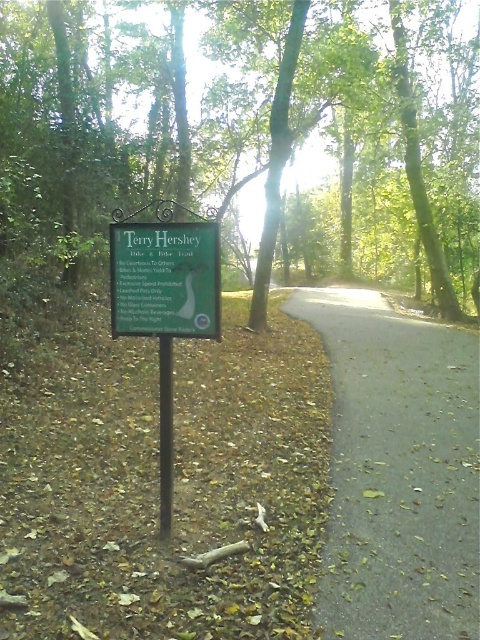
You are standing at the signpost on the left side of the path and want to walk directly towards the green leafy tree at center. In which direction should you walk relative to the path?

You should walk towards the center of the path since the green leafy tree at center is located at point (238, 125), which is directly ahead along the path.

You are standing at the camera position and want to reach the point marked at coordinates (68, 102). If your walking speed is 1.5 meters per second, how many seconds will it take you to reach that point?

The distance between the point marked at coordinates (68, 102) and your current position is 7.44 meters. At a walking speed of 1.5 meters per second, it will take approximately 4.96 seconds to reach the point.